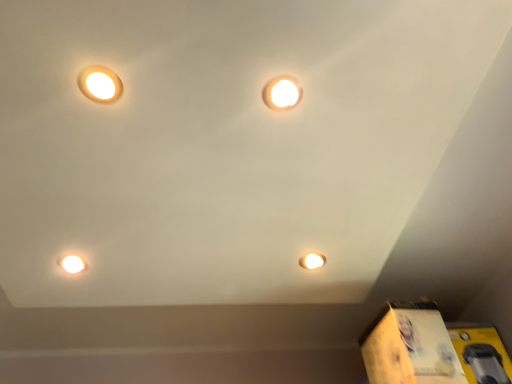
Question: Is yellow cardboard box at lower right, which ranks as the first cardboard box in right-to-left order, with yellow cardboard box at lower right, which ranks as the second cardboard box in right-to-left order?

Choices:
 (A) no
 (B) yes

Answer: (A)

Question: From a real-world perspective, is yellow cardboard box at lower right, acting as the 2th cardboard box starting from the left, physically above yellow cardboard box at lower right, marked as the 1th cardboard box in a left-to-right arrangement?

Choices:
 (A) yes
 (B) no

Answer: (B)

Question: Does yellow cardboard box at lower right, which ranks as the first cardboard box in right-to-left order, have a larger size compared to yellow cardboard box at lower right, marked as the 1th cardboard box in a left-to-right arrangement?

Choices:
 (A) yes
 (B) no

Answer: (B)

Question: Would you say yellow cardboard box at lower right, which ranks as the first cardboard box in right-to-left order, is outside yellow cardboard box at lower right, which ranks as the second cardboard box in right-to-left order?

Choices:
 (A) no
 (B) yes

Answer: (B)

Question: Is yellow cardboard box at lower right, marked as the 1th cardboard box in a left-to-right arrangement, at the back of yellow cardboard box at lower right, acting as the 2th cardboard box starting from the left?

Choices:
 (A) yes
 (B) no

Answer: (B)

Question: From their relative heights in the image, would you say yellow cardboard box at lower right, which ranks as the first cardboard box in right-to-left order, is taller or shorter than matte white lamp at upper left, which is counted as the 1th lamp, starting from the left?

Choices:
 (A) short
 (B) tall

Answer: (B)

Question: Is yellow cardboard box at lower right, acting as the 2th cardboard box starting from the left, inside the boundaries of matte white lamp at upper left, marked as the 2th lamp in a right-to-left arrangement, or outside?

Choices:
 (A) inside
 (B) outside

Answer: (B)

Question: From a real-world perspective, is yellow cardboard box at lower right, which ranks as the first cardboard box in right-to-left order, positioned above or below matte white lamp at upper left, which is counted as the 1th lamp, starting from the left?

Choices:
 (A) below
 (B) above

Answer: (A)

Question: Is yellow cardboard box at lower right, acting as the 2th cardboard box starting from the left, bigger or smaller than matte white lamp at upper left, marked as the 2th lamp in a right-to-left arrangement?

Choices:
 (A) big
 (B) small

Answer: (A)

Question: Considering the positions of point (290, 82) and point (102, 100), is point (290, 82) closer or farther from the camera than point (102, 100)?

Choices:
 (A) closer
 (B) farther

Answer: (B)

Question: In terms of size, does matte white light at upper center, which is the second lamp from left to right, appear bigger or smaller than matte white lamp at upper left, which is counted as the 1th lamp, starting from the left?

Choices:
 (A) small
 (B) big

Answer: (B)

Question: Relative to matte white lamp at upper left, which is counted as the 1th lamp, starting from the left, is matte white light at upper center, which is the second lamp from left to right, in front or behind?

Choices:
 (A) behind
 (B) front

Answer: (A)

Question: Is matte white light at upper center, the 1th lamp in the right-to-left sequence, to the left or to the right of matte white lamp at upper left, which is counted as the 1th lamp, starting from the left, in the image?

Choices:
 (A) left
 (B) right

Answer: (B)

Question: Based on their positions, is yellow cardboard box at lower right, which ranks as the second cardboard box in right-to-left order, located to the left or right of matte white light bulb at lower left?

Choices:
 (A) right
 (B) left

Answer: (A)

Question: Is yellow cardboard box at lower right, marked as the 1th cardboard box in a left-to-right arrangement, spatially inside matte white light bulb at lower left, or outside of it?

Choices:
 (A) inside
 (B) outside

Answer: (B)